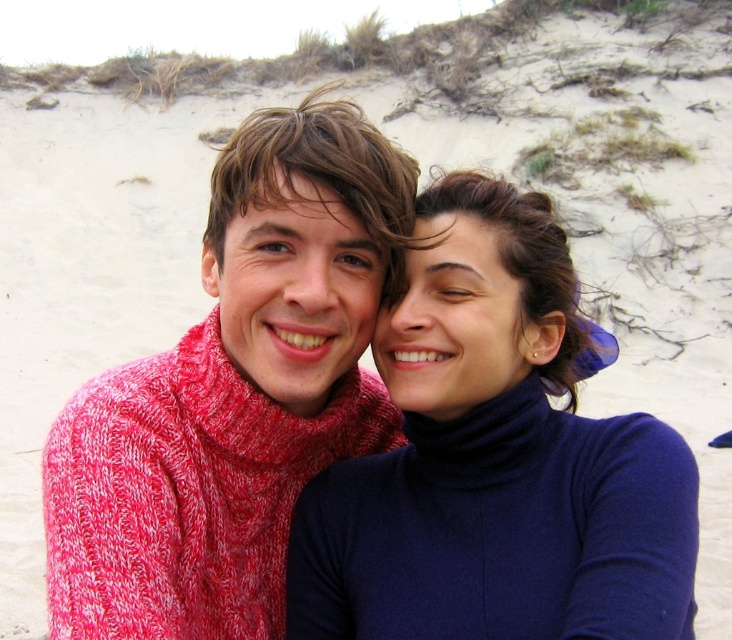
Question: Among these objects, which one is farthest from the camera?

Choices:
 (A) matte blue turtleneck at center
 (B) knitted red sweater at center

Answer: (B)

Question: Can you confirm if matte blue turtleneck at center is positioned above knitted red sweater at center?

Choices:
 (A) yes
 (B) no

Answer: (B)

Question: Among these objects, which one is farthest from the camera?

Choices:
 (A) matte blue turtleneck at center
 (B) knitted red sweater at center

Answer: (B)

Question: In this image, where is matte blue turtleneck at center located relative to knitted red sweater at center?

Choices:
 (A) above
 (B) below

Answer: (B)

Question: Is matte blue turtleneck at center above knitted red sweater at center?

Choices:
 (A) yes
 (B) no

Answer: (B)